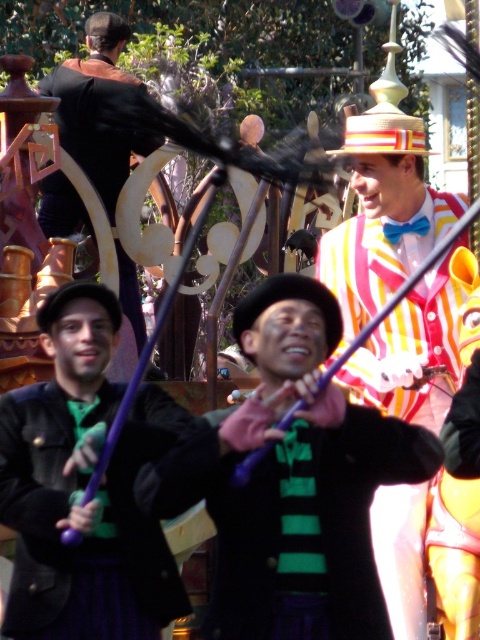
Who is positioned more to the right, green striped scarf at center or striped cotton suit at center?

Positioned to the right is striped cotton suit at center.

Does green striped scarf at center appear on the right side of striped cotton suit at center?

Incorrect, green striped scarf at center is not on the right side of striped cotton suit at center.

Does point (346, 547) come farther from viewer compared to point (421, 288)?

No.

Locate an element on the screen. The width and height of the screenshot is (480, 640). green striped scarf at center is located at coordinates coord(284,515).

Does matte purple wand at center appear over green striped scarf at center?

Yes, matte purple wand at center is above green striped scarf at center.

Describe the element at coordinates (84, 486) in the screenshot. The height and width of the screenshot is (640, 480). I see `matte purple wand at center` at that location.

Does point (72, 380) lie behind point (333, 577)?

That is True.

The width and height of the screenshot is (480, 640). Find the location of `matte purple wand at center`. matte purple wand at center is located at coordinates (84, 486).

Looking at this image, can you confirm if matte purple wand at center is taller than striped cotton suit at center?

No, matte purple wand at center is not taller than striped cotton suit at center.

Does point (52, 518) come in front of point (453, 282)?

Yes.

Locate an element on the screen. matte purple wand at center is located at coordinates (84, 486).